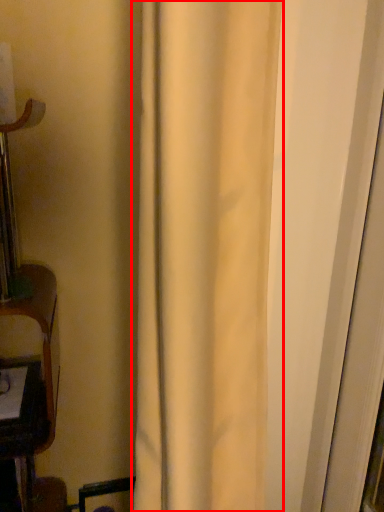
Question: In this image, where is curtain (annotated by the red box) located relative to screen door?

Choices:
 (A) right
 (B) left

Answer: (B)